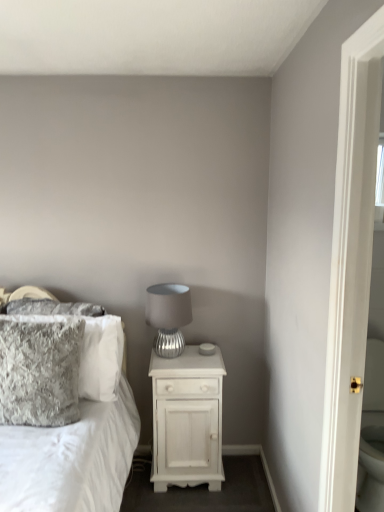
Question: Is velvety gray pillow at left, the second pillow positioned from the front, looking in the opposite direction of white fluffy pillow at left?

Choices:
 (A) no
 (B) yes

Answer: (B)

Question: Is velvety gray pillow at left, the second pillow positioned from the front, outside of white fluffy pillow at left?

Choices:
 (A) yes
 (B) no

Answer: (B)

Question: From the image's perspective, is velvety gray pillow at left, the first pillow in the back-to-front sequence, over white fluffy pillow at left?

Choices:
 (A) no
 (B) yes

Answer: (B)

Question: Considering the relative positions of velvety gray pillow at left, the second pillow positioned from the front, and white fluffy pillow at left in the image provided, is velvety gray pillow at left, the second pillow positioned from the front, behind white fluffy pillow at left?

Choices:
 (A) no
 (B) yes

Answer: (B)

Question: Is white fluffy pillow at left inside velvety gray pillow at left, the first pillow in the back-to-front sequence?

Choices:
 (A) yes
 (B) no

Answer: (B)

Question: Choose the correct answer: Is velvety gray pillow at left, the first pillow in the back-to-front sequence, inside fuzzy gray pillow at left, which is counted as the 1th pillow, starting from the front, or outside it?

Choices:
 (A) inside
 (B) outside

Answer: (B)

Question: From a real-world perspective, is velvety gray pillow at left, the second pillow positioned from the front, positioned above or below fuzzy gray pillow at left, the 2th pillow from the back?

Choices:
 (A) above
 (B) below

Answer: (B)

Question: From the image's perspective, is velvety gray pillow at left, the second pillow positioned from the front, located above or below fuzzy gray pillow at left, which is counted as the 1th pillow, starting from the front?

Choices:
 (A) above
 (B) below

Answer: (B)

Question: From their relative heights in the image, would you say velvety gray pillow at left, the second pillow positioned from the front, is taller or shorter than fuzzy gray pillow at left, the 2th pillow from the back?

Choices:
 (A) tall
 (B) short

Answer: (B)

Question: From the image's perspective, is silver textured lamp at center above or below white wood nightstand at center?

Choices:
 (A) above
 (B) below

Answer: (A)

Question: Considering the positions of silver textured lamp at center and white wood nightstand at center in the image, is silver textured lamp at center bigger or smaller than white wood nightstand at center?

Choices:
 (A) small
 (B) big

Answer: (A)

Question: Is point (148, 306) closer or farther from the camera than point (192, 450)?

Choices:
 (A) closer
 (B) farther

Answer: (B)

Question: Considering their positions, is silver textured lamp at center located in front of or behind white wood nightstand at center?

Choices:
 (A) behind
 (B) front

Answer: (A)

Question: Considering their positions, is silver textured lamp at center located in front of or behind white fluffy pillow at left?

Choices:
 (A) front
 (B) behind

Answer: (B)

Question: Is silver textured lamp at center bigger or smaller than white fluffy pillow at left?

Choices:
 (A) small
 (B) big

Answer: (A)